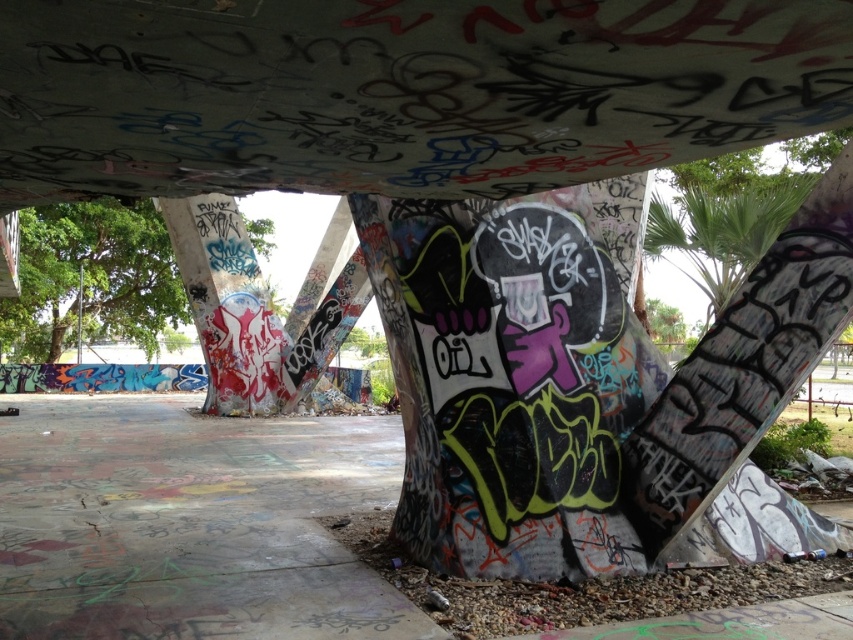
Question: Which point is closer to the camera?

Choices:
 (A) green leafy tree at upper right
 (B) green leafy tree at left
 (C) graffiti-covered concrete pillar at center

Answer: (A)

Question: Is green leafy tree at left positioned behind graffiti-covered concrete pillar at center?

Choices:
 (A) yes
 (B) no

Answer: (A)

Question: Can you confirm if green leafy tree at left is positioned below graffiti-covered concrete pillar at center?

Choices:
 (A) no
 (B) yes

Answer: (A)

Question: Considering the real-world distances, which object is closest to the green leafy tree at left?

Choices:
 (A) graffiti-covered concrete pillar at center
 (B) green leafy tree at upper right

Answer: (A)

Question: Which of these objects is positioned closest to the green leafy tree at left?

Choices:
 (A) green leafy tree at upper right
 (B) graffiti-covered concrete pillar at center

Answer: (B)

Question: Is green leafy tree at left wider than green leafy tree at upper right?

Choices:
 (A) yes
 (B) no

Answer: (A)